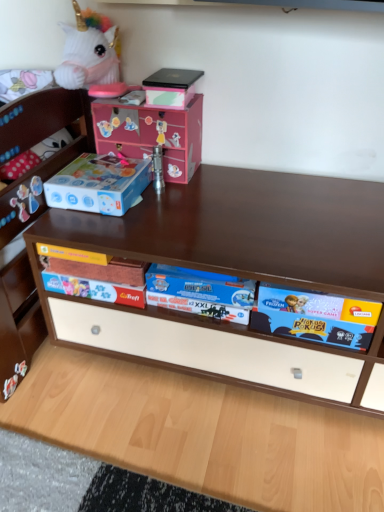
Question: Is blue cardboard storage box at left spatially inside matte black box at upper center, or outside of it?

Choices:
 (A) inside
 (B) outside

Answer: (B)

Question: In the image, is blue cardboard storage box at left positioned in front of or behind matte black box at upper center?

Choices:
 (A) front
 (B) behind

Answer: (A)

Question: Estimate the real-world distances between objects in this image. Which object is farther from the matte black box at upper center?

Choices:
 (A) pink cardboard box at upper center
 (B) blue cardboard storage box at left
 (C) blue cardboard game box at center

Answer: (C)

Question: Estimate the real-world distances between objects in this image. Which object is closer to the pink cardboard box at upper center?

Choices:
 (A) blue cardboard game box at center
 (B) blue cardboard storage box at left
 (C) matte black box at upper center

Answer: (C)